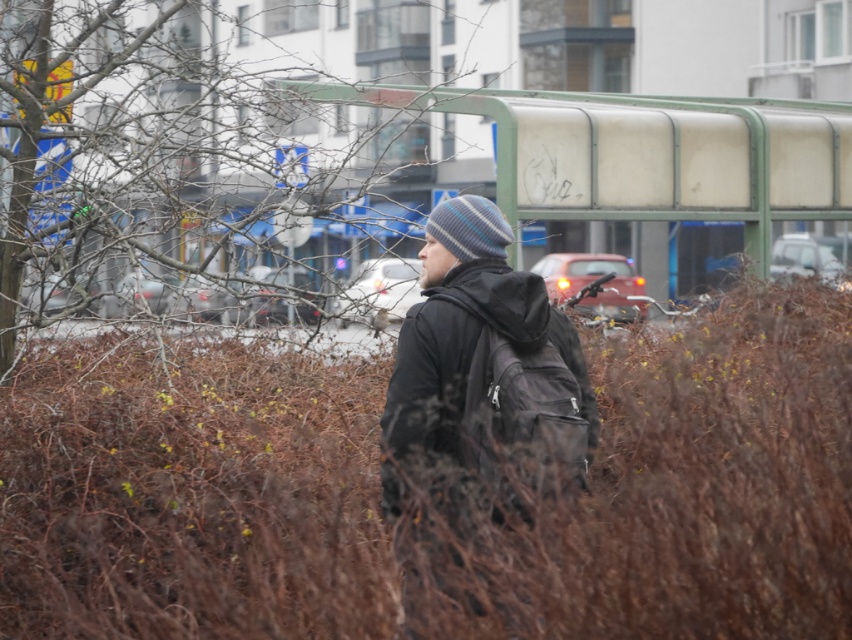
Does brown dry bush at center have a larger size compared to bare branches at center?

No.

Does brown dry bush at center have a smaller size compared to bare branches at center?

Yes.

Does point (683, 512) lie behind point (79, 138)?

No.

The height and width of the screenshot is (640, 852). I want to click on brown dry bush at center, so click(x=435, y=518).

Can you confirm if bare branches at center is positioned below black matte jacket at center?

Actually, bare branches at center is above black matte jacket at center.

Can you confirm if bare branches at center is wider than black matte jacket at center?

Yes.

Is point (393, 109) in front of point (514, 323)?

No, it is behind (514, 323).

Where is `bare branches at center`? bare branches at center is located at coordinates (320, 140).

Is brown dry bush at center wider than black matte jacket at center?

Yes, brown dry bush at center is wider than black matte jacket at center.

Which is more to the right, brown dry bush at center or black matte jacket at center?

From the viewer's perspective, black matte jacket at center appears more on the right side.

The height and width of the screenshot is (640, 852). Describe the element at coordinates (435, 518) in the screenshot. I see `brown dry bush at center` at that location.

Locate an element on the screen. This screenshot has height=640, width=852. brown dry bush at center is located at coordinates [x=435, y=518].